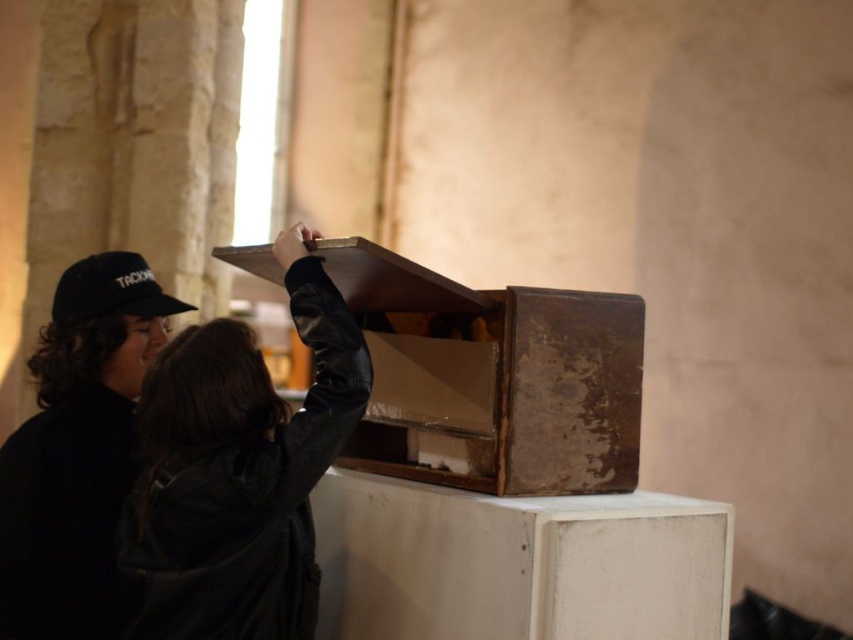
Is point (157, 436) less distant than point (73, 266)?

Yes, point (157, 436) is closer to viewer.

Does point (302, 515) come in front of point (148, 291)?

Yes.

Where is `matte black jacket at center`? Image resolution: width=853 pixels, height=640 pixels. matte black jacket at center is located at coordinates point(238,470).

Can you confirm if matte black jacket at center is positioned to the right of black leather jacket at left?

Yes, matte black jacket at center is to the right of black leather jacket at left.

The width and height of the screenshot is (853, 640). Describe the element at coordinates (238, 470) in the screenshot. I see `matte black jacket at center` at that location.

At what (x,y) coordinates should I click in order to perform the action: click on matte black jacket at center. Please return your answer as a coordinate pair (x, y). Looking at the image, I should click on (238, 470).

Between rusty wood box at center and black leather jacket at left, which one is positioned higher?

Positioned higher is rusty wood box at center.

Describe the element at coordinates (492, 378) in the screenshot. This screenshot has width=853, height=640. I see `rusty wood box at center` at that location.

Image resolution: width=853 pixels, height=640 pixels. What are the coordinates of `rusty wood box at center` in the screenshot? It's located at (492, 378).